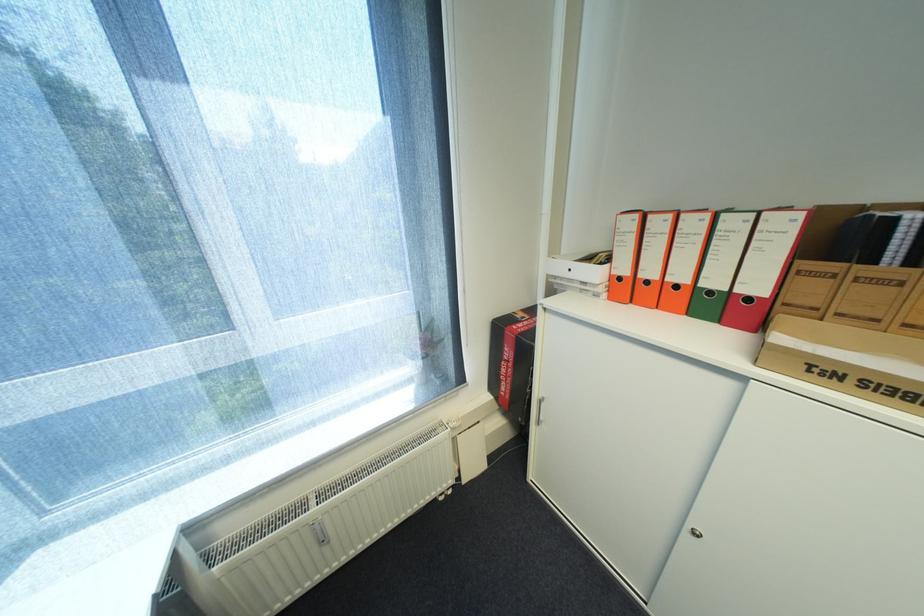
Where would you pull the red ring binder? Please return your answer as a coordinate pair (x, y).

(763, 267)